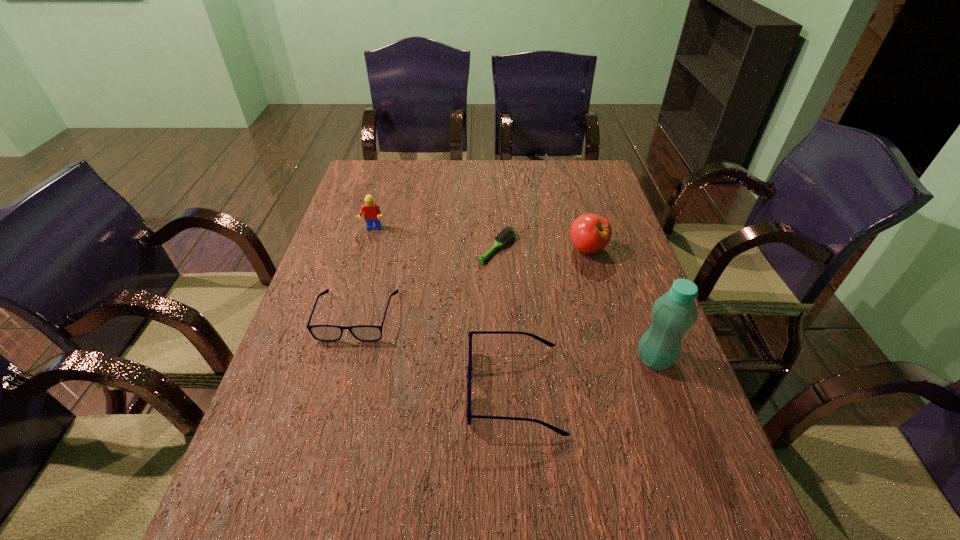
Identify the location of free point that satisfies the following two spatial constraints: 1. on the front-facing side of the hairbrush; 2. on the right side of the Lego. (367, 248).

Where is `blank space that satisfies the following two spatial constraints: 1. on the front-facing side of the apple; 2. on the left side of the Lego`? The height and width of the screenshot is (540, 960). blank space that satisfies the following two spatial constraints: 1. on the front-facing side of the apple; 2. on the left side of the Lego is located at coordinates (367, 249).

Where is `vacant space that satisfies the following two spatial constraints: 1. on the front-facing side of the shortest object; 2. on the right side of the Lego`? This screenshot has height=540, width=960. vacant space that satisfies the following two spatial constraints: 1. on the front-facing side of the shortest object; 2. on the right side of the Lego is located at coordinates (367, 248).